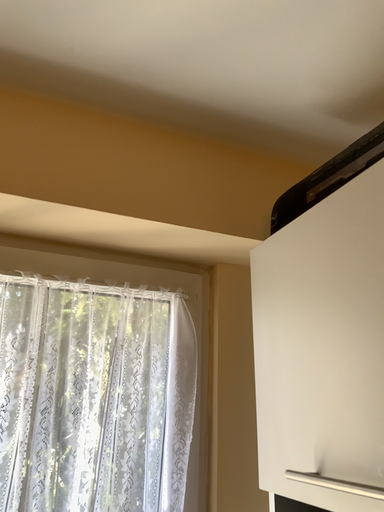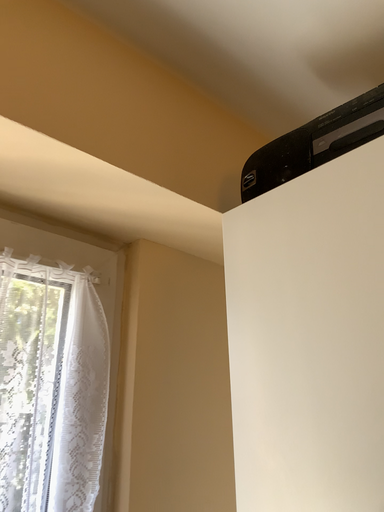
Question: How did the camera likely rotate when shooting the video?

Choices:
 (A) rotated right
 (B) rotated left

Answer: (A)